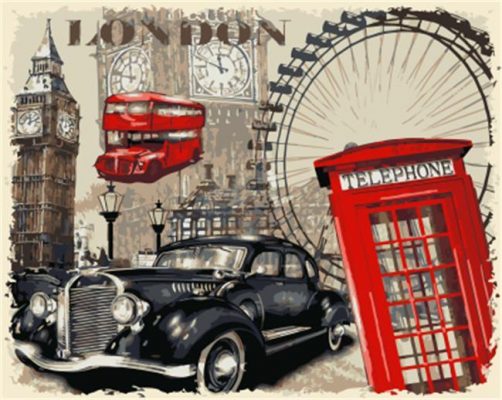
This screenshot has height=400, width=502. In order to click on booth in this screenshot , I will do `click(392, 178)`.